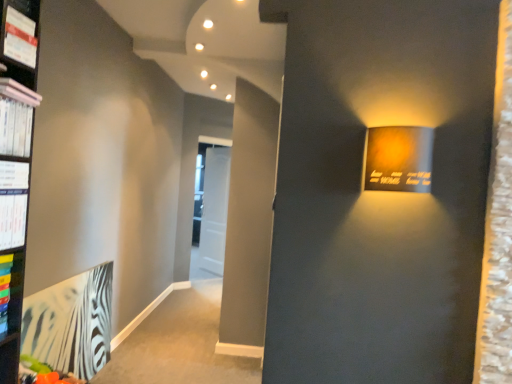
Question: From a real-world perspective, is matte white magazine at upper left, positioned as the second magazine in bottom-to-top order, physically below zebra-patterned paper at lower left, placed as the 2th paperback book when sorted from front to back?

Choices:
 (A) no
 (B) yes

Answer: (A)

Question: Does matte white magazine at upper left, placed as the 1th magazine when sorted from top to bottom, turn towards zebra-patterned paper at lower left, the 1th paperback book positioned from the back?

Choices:
 (A) yes
 (B) no

Answer: (B)

Question: Would you say matte white magazine at upper left, positioned as the second magazine in bottom-to-top order, is a long distance from zebra-patterned paper at lower left, the 2th paperback book in the top-to-bottom sequence?

Choices:
 (A) no
 (B) yes

Answer: (B)

Question: Considering the relative sizes of matte white magazine at upper left, placed as the 1th magazine when sorted from top to bottom, and zebra-patterned paper at lower left, the 2th paperback book from the right, in the image provided, is matte white magazine at upper left, placed as the 1th magazine when sorted from top to bottom, shorter than zebra-patterned paper at lower left, the 2th paperback book from the right,?

Choices:
 (A) yes
 (B) no

Answer: (A)

Question: Is matte white magazine at upper left, placed as the 1th magazine when sorted from top to bottom, taller than zebra-patterned paper at lower left, the 1th paperback book positioned from the back?

Choices:
 (A) yes
 (B) no

Answer: (B)

Question: Considering the relative sizes of matte white magazine at upper left, placed as the 1th magazine when sorted from top to bottom, and zebra-patterned paper at lower left, acting as the first paperback book starting from the left, in the image provided, is matte white magazine at upper left, placed as the 1th magazine when sorted from top to bottom, wider than zebra-patterned paper at lower left, acting as the first paperback book starting from the left,?

Choices:
 (A) yes
 (B) no

Answer: (A)

Question: Does zebra-patterned paper at lower left, acting as the first paperback book starting from the left, have a lesser height compared to white glossy magazine at left, the 2th magazine from the top?

Choices:
 (A) yes
 (B) no

Answer: (B)

Question: Does zebra-patterned paper at lower left, placed as the 2th paperback book when sorted from front to back, have a smaller size compared to white glossy magazine at left, the 2th magazine from the top?

Choices:
 (A) yes
 (B) no

Answer: (B)

Question: Is zebra-patterned paper at lower left, the 2th paperback book in the top-to-bottom sequence, oriented towards white glossy magazine at left, acting as the 1th magazine starting from the bottom?

Choices:
 (A) no
 (B) yes

Answer: (A)

Question: Does zebra-patterned paper at lower left, the 2th paperback book in the top-to-bottom sequence, appear on the left side of white glossy magazine at left, acting as the 1th magazine starting from the bottom?

Choices:
 (A) no
 (B) yes

Answer: (B)

Question: Considering the relative sizes of zebra-patterned paper at lower left, the 1th paperback book positioned from the back, and white glossy magazine at left, acting as the 1th magazine starting from the bottom, in the image provided, is zebra-patterned paper at lower left, the 1th paperback book positioned from the back, taller than white glossy magazine at left, acting as the 1th magazine starting from the bottom,?

Choices:
 (A) yes
 (B) no

Answer: (A)

Question: Is the position of zebra-patterned paper at lower left, placed as the 2th paperback book when sorted from front to back, more distant than that of white glossy magazine at left, the 2th magazine from the top?

Choices:
 (A) yes
 (B) no

Answer: (A)

Question: Does matte white magazine at upper left, placed as the 1th magazine when sorted from top to bottom, turn towards pink matte book at upper left?

Choices:
 (A) no
 (B) yes

Answer: (A)